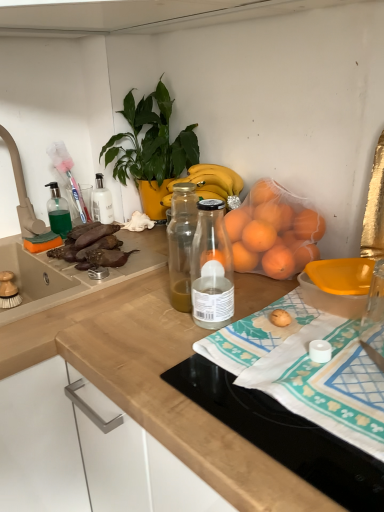
Where is `free spot to the right of brown matte eggplant at left`? The width and height of the screenshot is (384, 512). free spot to the right of brown matte eggplant at left is located at coordinates (145, 257).